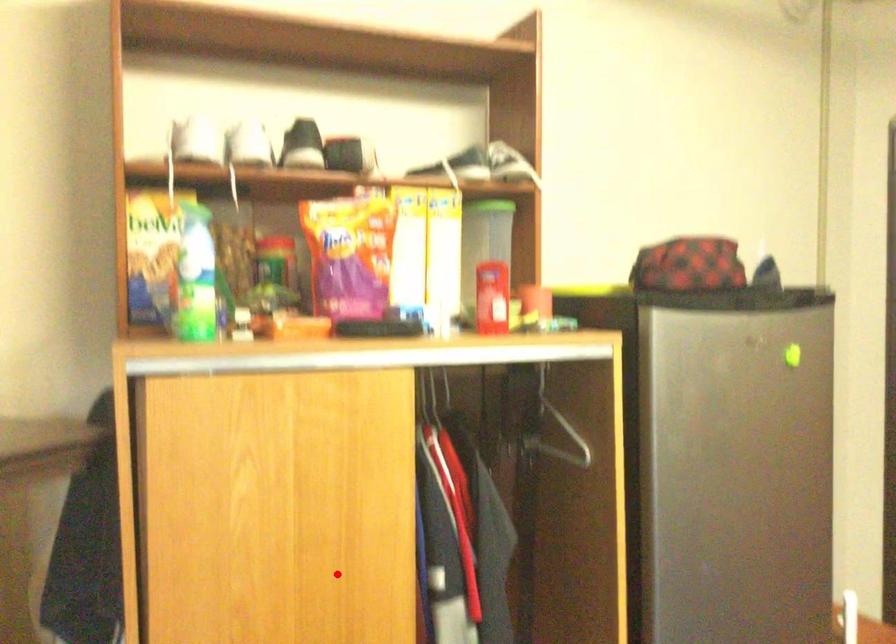
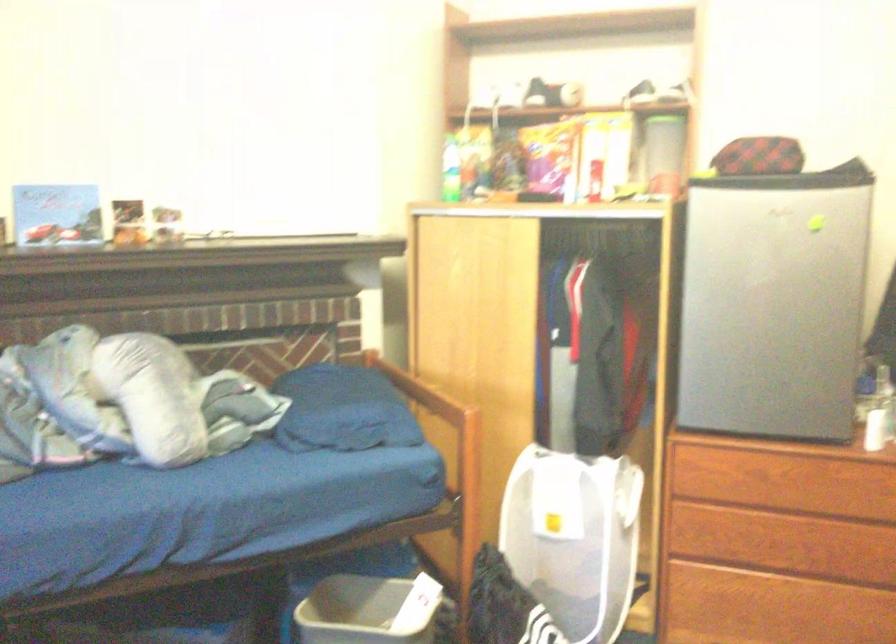
Where in the second image is the point corresponding to the highlighted location from the first image?

(502, 323)